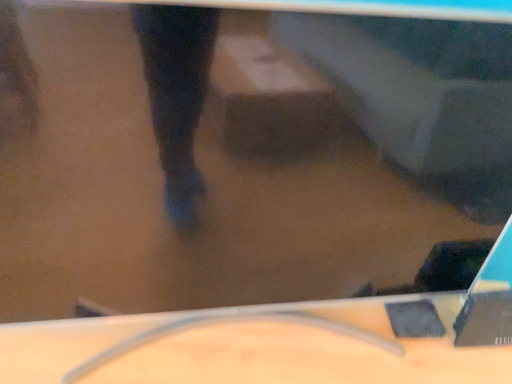
I want to click on wooden table at lower center, so [x=275, y=344].

In order to face wooden table at lower center, should I rotate leftwards or rightwards?

You should rotate right by 0.625 degrees.

What do you see at coordinates (275, 344) in the screenshot?
I see `wooden table at lower center` at bounding box center [275, 344].

Identify the location of wooden table at lower center. (275, 344).